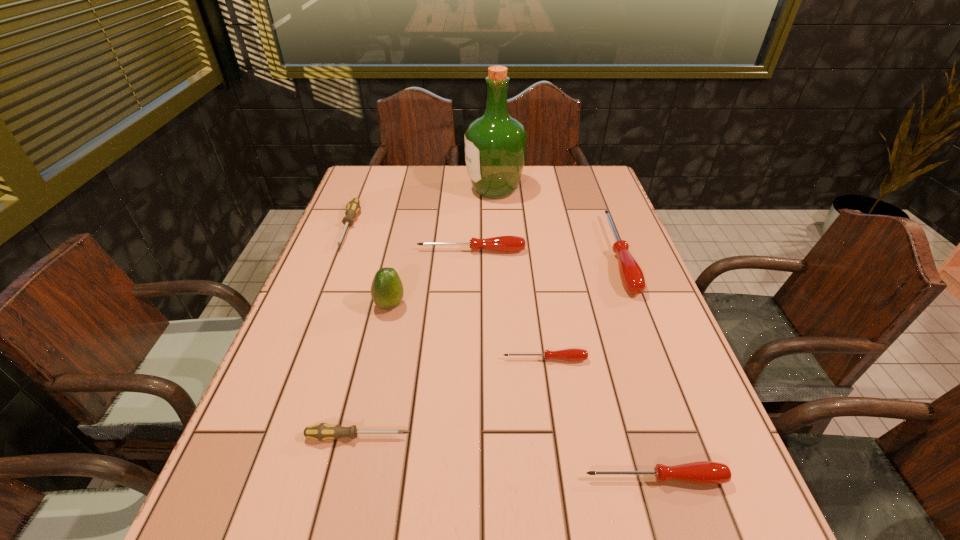
At what (x,y) coordinates should I click in order to perform the action: click on free space that satisfies the following two spatial constraints: 1. at the tip of the leftmost object; 2. on the left side of the nearest screwdriver. Please return your answer as a coordinate pair (x, y). This screenshot has width=960, height=540. Looking at the image, I should click on (252, 478).